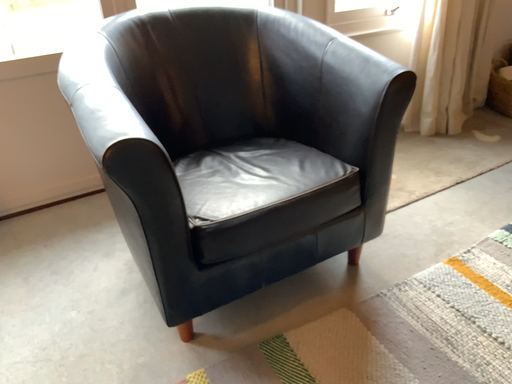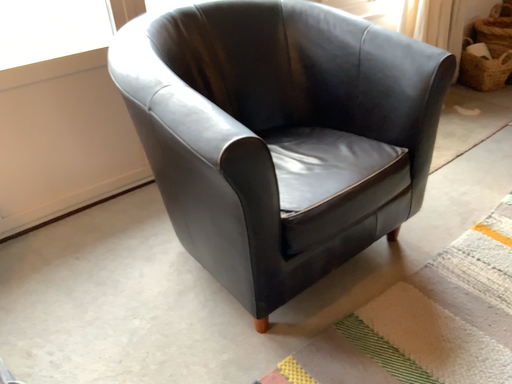
Question: Which way did the camera rotate in the video?

Choices:
 (A) rotated right
 (B) rotated left

Answer: (A)